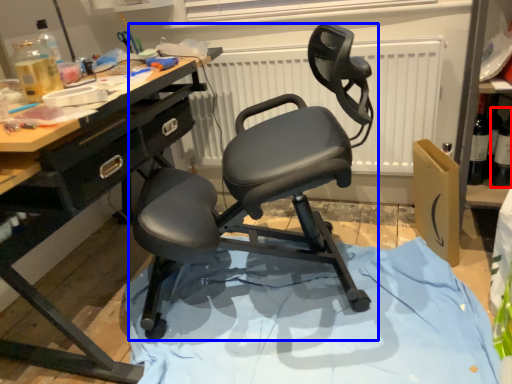
Question: Which object appears closest to the camera in this image, bottle (highlighted by a red box) or chair (highlighted by a blue box)?

Choices:
 (A) bottle
 (B) chair

Answer: (B)